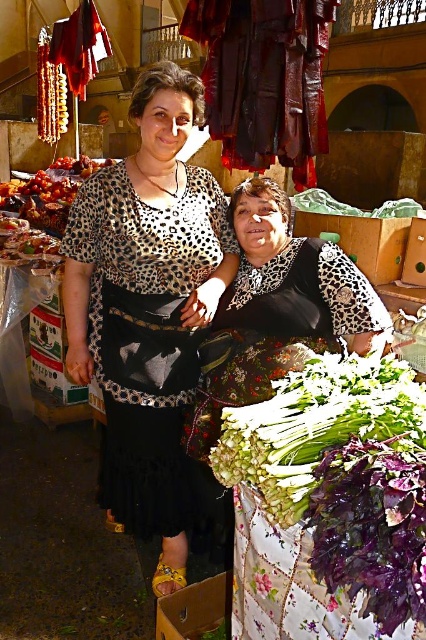
Question: Where is leopard print blouse at center located in relation to green leafy vegetables at lower right in the image?

Choices:
 (A) above
 (B) below

Answer: (A)

Question: Among these points, which one is farthest from the camera?

Choices:
 (A) (377, 492)
 (B) (172, 572)

Answer: (B)

Question: Is leopard print blouse at center to the right of green leafy vegetables at lower right from the viewer's perspective?

Choices:
 (A) yes
 (B) no

Answer: (B)

Question: Is leopard print blouse at center thinner than green leafy vegetables at lower right?

Choices:
 (A) yes
 (B) no

Answer: (B)

Question: Which point is closer to the camera?

Choices:
 (A) (241, 419)
 (B) (172, 513)

Answer: (A)